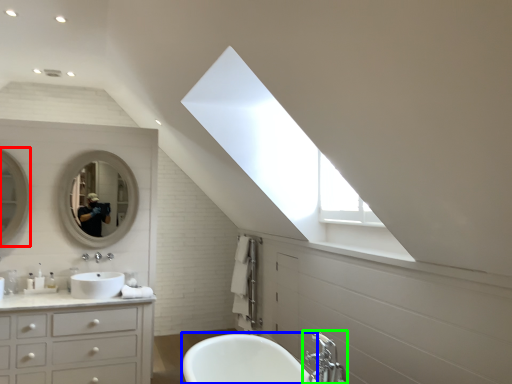
Question: Which object is the closest to the mirror (highlighted by a red box)? Choose among these: bath (highlighted by a blue box) or tap (highlighted by a green box).

Choices:
 (A) bath
 (B) tap

Answer: (A)